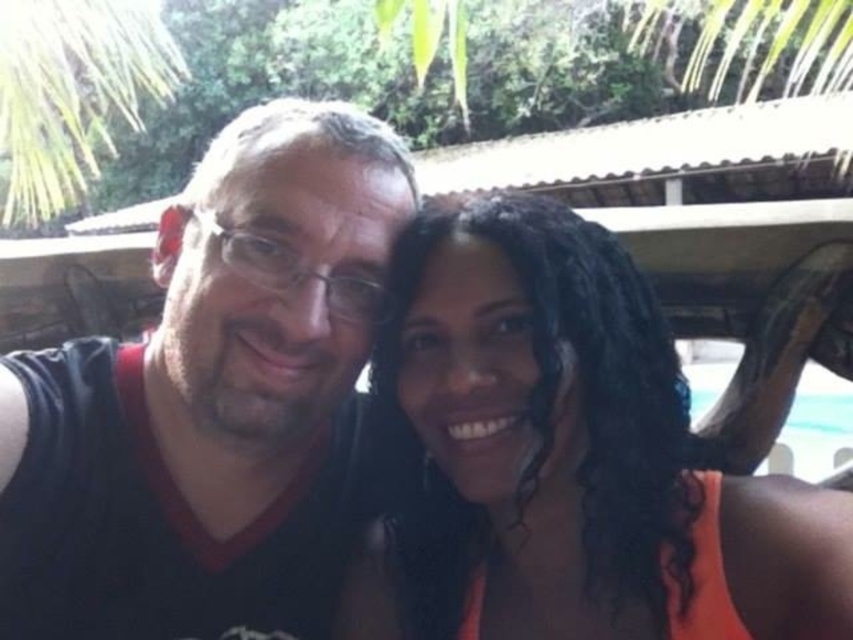
Who is higher up, orange fabric at center or black matte shirt at center?

black matte shirt at center is above.

Is orange fabric at center closer to the viewer compared to black matte shirt at center?

Yes.

Locate an element on the screen. The width and height of the screenshot is (853, 640). orange fabric at center is located at coordinates (566, 456).